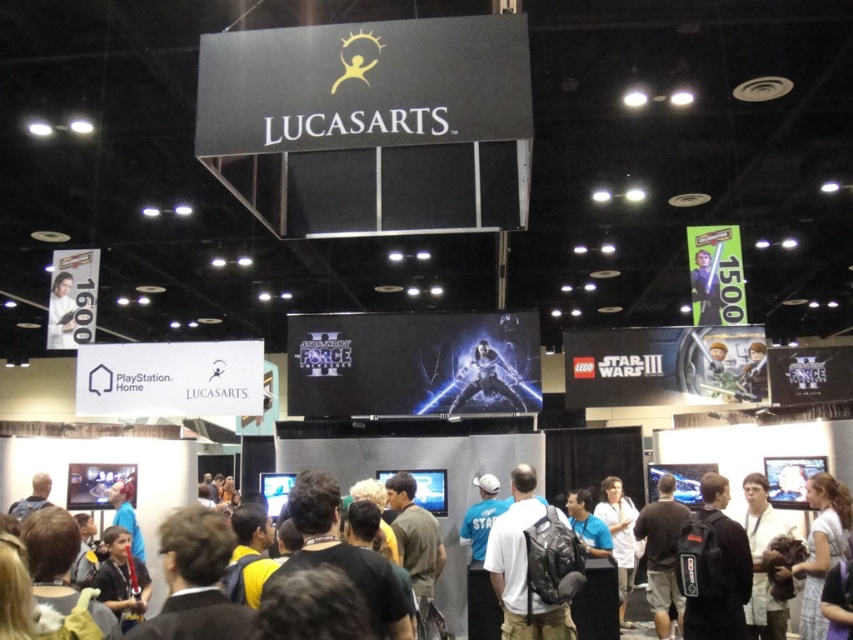
Question: Is dark brown fur coat at lower right to the left of matte black figure at center from the viewer's perspective?

Choices:
 (A) no
 (B) yes

Answer: (A)

Question: Is dark blue shirt at center below white matte poster at upper left?

Choices:
 (A) yes
 (B) no

Answer: (A)

Question: Which of the following is the farthest from the observer?

Choices:
 (A) matte black figure at center
 (B) metallic silver sword at center

Answer: (B)

Question: Does black backpack at center lie behind white matte poster at upper left?

Choices:
 (A) yes
 (B) no

Answer: (B)

Question: Which of the following is the farthest from the observer?

Choices:
 (A) (757, 630)
 (B) (508, 385)
 (C) (712, 298)

Answer: (C)

Question: Which of the following is the farthest from the observer?

Choices:
 (A) metallic silver sword at center
 (B) dark brown fur coat at lower right
 (C) white matte backpack at center

Answer: (A)